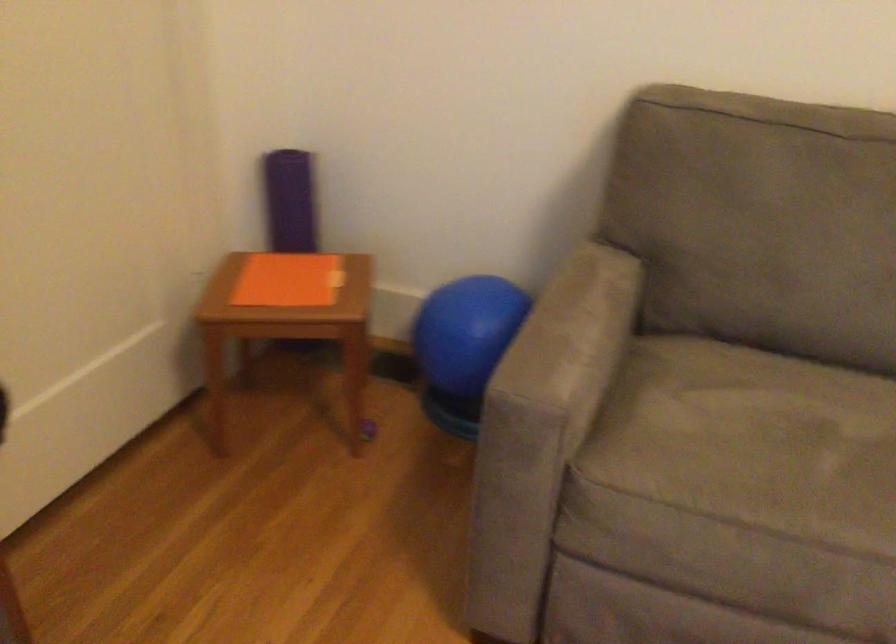
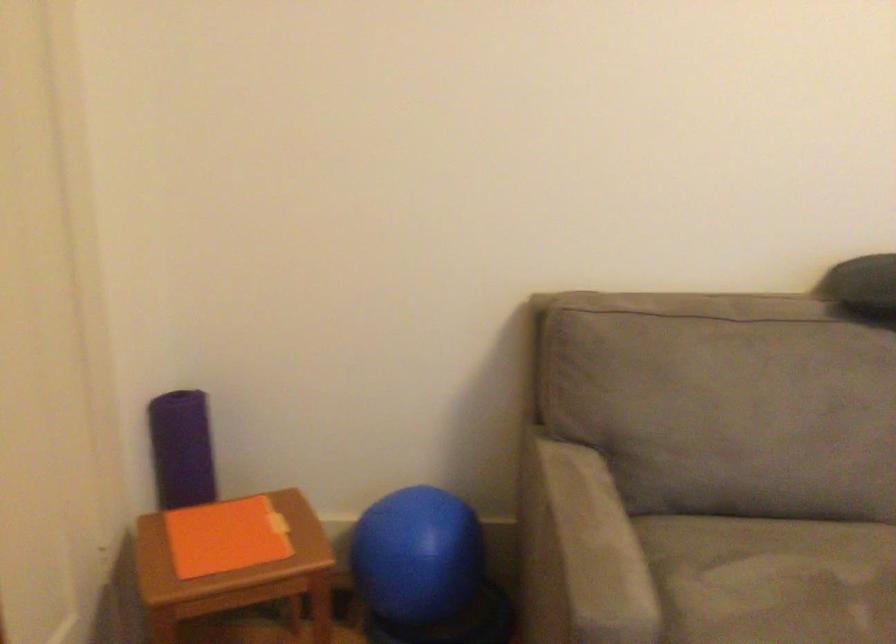
Find the pixel in the second image that matches the point at 282,279 in the first image.

(226, 536)